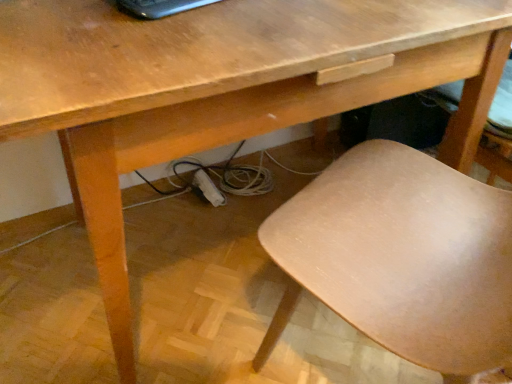
At what (x,y) coordinates should I click in order to perform the action: click on free spot to the left of light brown wood chair at lower right. Please return your answer as a coordinate pair (x, y). Looking at the image, I should click on (200, 303).